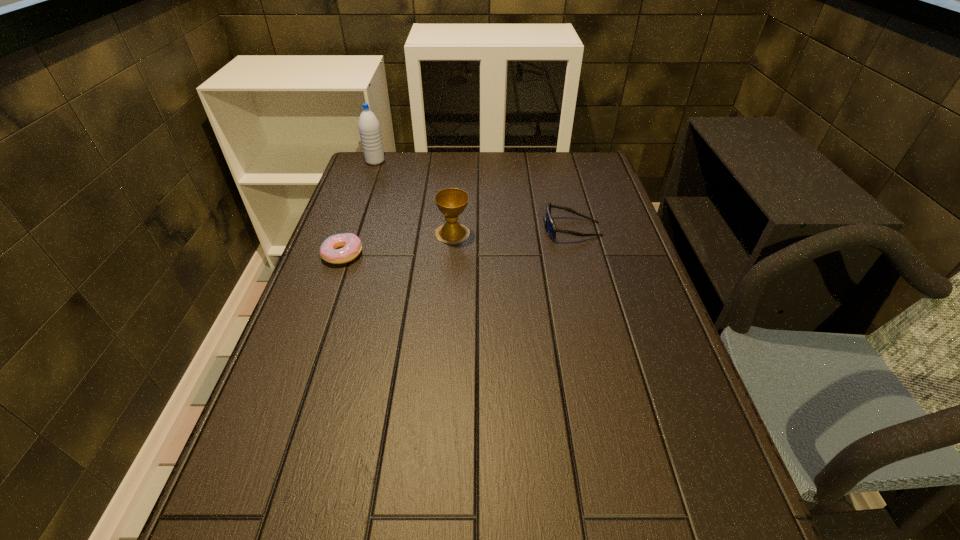
In the image, there is a desktop. Where is `vacant space at the right edge`? vacant space at the right edge is located at coordinates (606, 353).

This screenshot has width=960, height=540. What are the coordinates of `free spot between the tallest object and the sunglasses` in the screenshot? It's located at point(473,195).

Identify the location of vacant area that lies between the chalice and the water bottle. This screenshot has width=960, height=540. (414, 197).

Where is `unoccupied area between the water bottle and the chalice`? unoccupied area between the water bottle and the chalice is located at coordinates (414, 197).

Identify the location of vacant region between the water bottle and the doughnut. This screenshot has width=960, height=540. (359, 207).

Identify the location of vacant space that is in between the farthest object and the rightmost object. (473, 195).

This screenshot has height=540, width=960. Find the location of `object that is the third nearest to the doughnut`. object that is the third nearest to the doughnut is located at coordinates (550, 226).

What are the coordinates of `the second closest object to the farthest object` in the screenshot? It's located at (351, 244).

I want to click on free space that satisfies the following two spatial constraints: 1. on the back side of the chalice; 2. on the right side of the shortest object, so click(349, 233).

Locate an element on the screen. The width and height of the screenshot is (960, 540). blank area in the image that satisfies the following two spatial constraints: 1. on the back side of the tallest object; 2. on the left side of the shortest object is located at coordinates (375, 161).